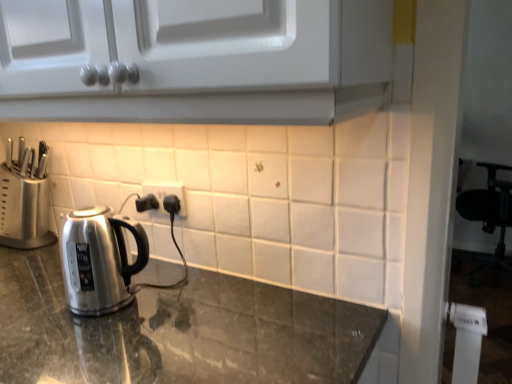
Question: Considering the positions of point (164, 192) and point (15, 322), is point (164, 192) closer or farther from the camera than point (15, 322)?

Choices:
 (A) closer
 (B) farther

Answer: (B)

Question: Considering the positions of white plastic electric outlet at center and shiny granite countertop at center in the image, is white plastic electric outlet at center taller or shorter than shiny granite countertop at center?

Choices:
 (A) short
 (B) tall

Answer: (A)

Question: Estimate the real-world distances between objects in this image. Which object is farther from the satin silver knife block at left?

Choices:
 (A) white plastic electric outlet at center
 (B) shiny granite countertop at center

Answer: (B)

Question: Which of these objects is positioned closest to the shiny granite countertop at center?

Choices:
 (A) satin silver knife block at left
 (B) white plastic electric outlet at center

Answer: (B)